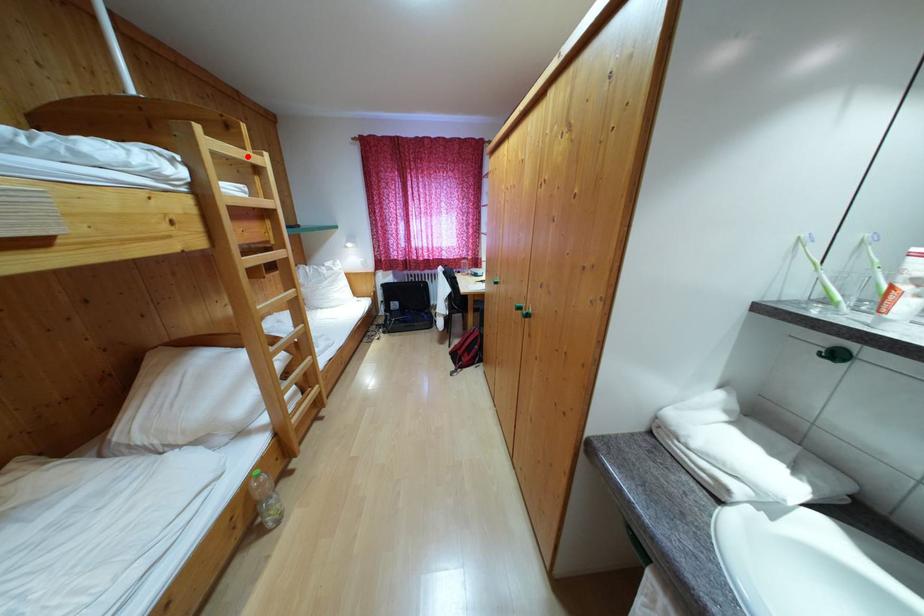
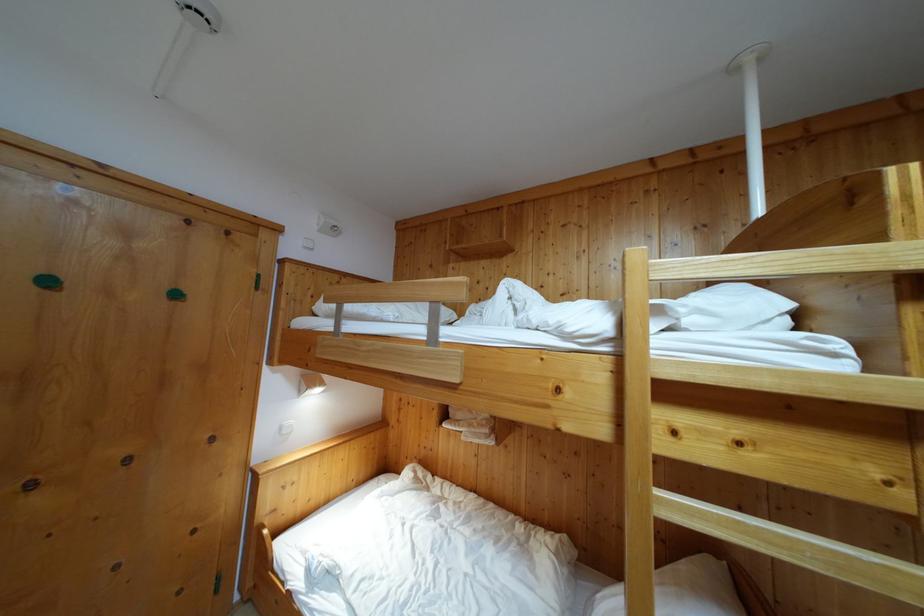
Where in the second image is the point corresponding to the highlighted location from the first image?

(881, 245)